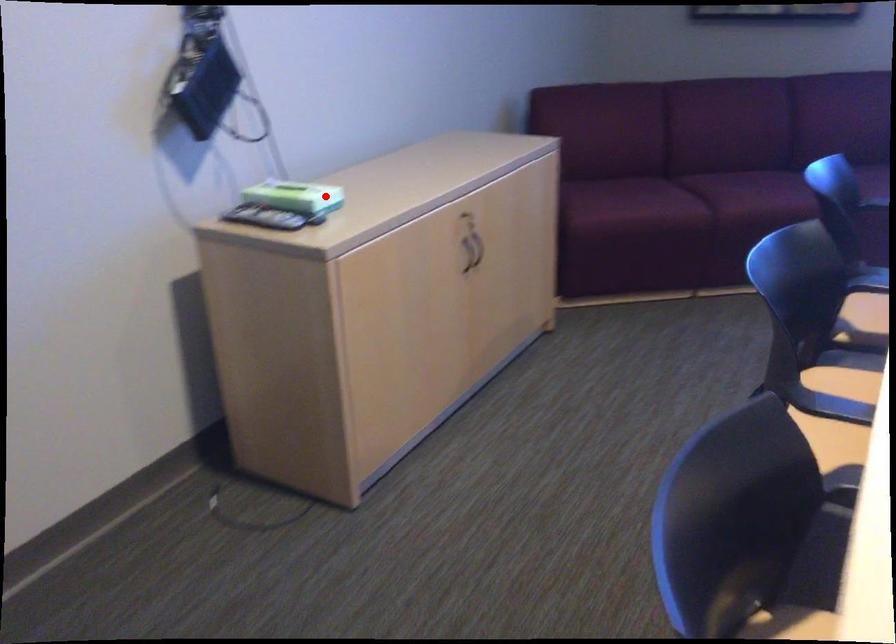
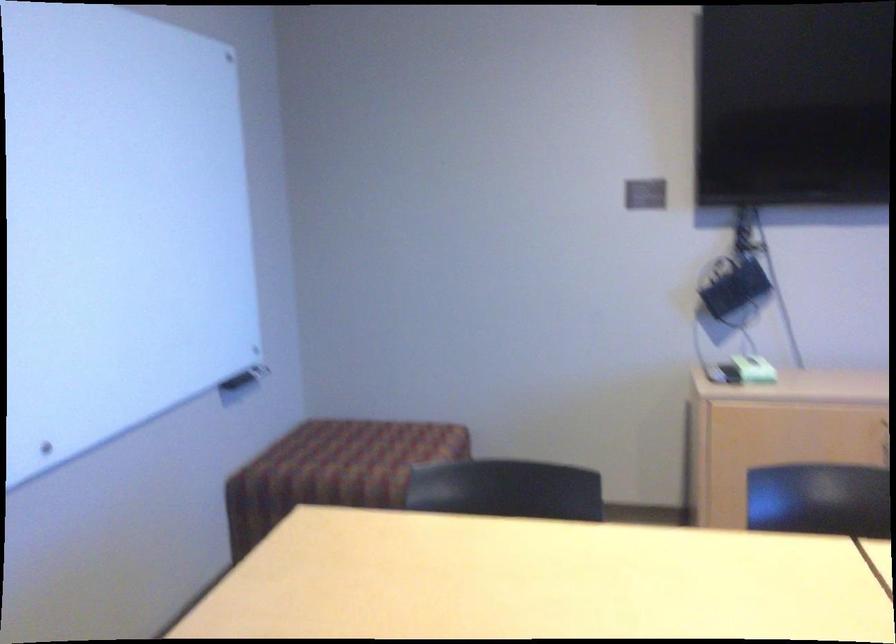
Locate, in the second image, the point that corresponds to the highlighted location in the first image.

(754, 368)